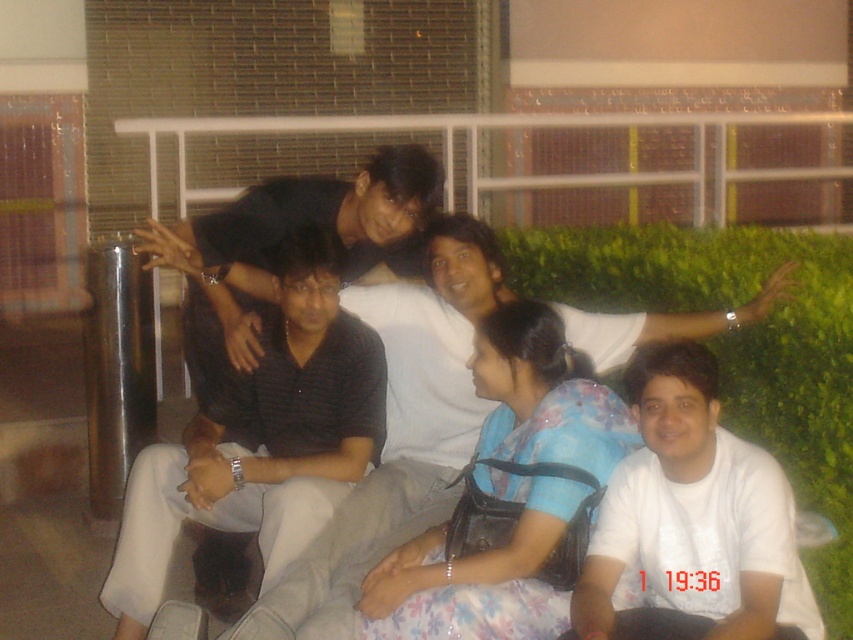
Where is `white matte shirt at lower right`? The width and height of the screenshot is (853, 640). white matte shirt at lower right is located at coordinates (693, 520).

Is white matte shirt at lower right shorter than floral fabric dress at center?

Indeed, white matte shirt at lower right has a lesser height compared to floral fabric dress at center.

Does point (643, 504) come farther from viewer compared to point (425, 545)?

No.

Where is `white matte shirt at lower right`? The width and height of the screenshot is (853, 640). white matte shirt at lower right is located at coordinates (693, 520).

Can you confirm if dark gray shirt at center is thinner than floral fabric dress at center?

In fact, dark gray shirt at center might be wider than floral fabric dress at center.

How much distance is there between dark gray shirt at center and floral fabric dress at center?

They are 13.74 inches apart.

Between point (364, 547) and point (509, 380), which one is positioned in front?

Point (509, 380)

Identify the location of dark gray shirt at center. (397, 429).

Is dark gray striped shirt at center smaller than dark gray shirt at center?

Correct, dark gray striped shirt at center occupies less space than dark gray shirt at center.

Is dark gray striped shirt at center further to camera compared to dark gray shirt at center?

Yes.

Does point (289, 508) come behind point (320, 554)?

Yes.

You are a GUI agent. You are given a task and a screenshot of the screen. Output one action in this format:
    pyautogui.click(x=<x>, y=<y>)
    Task: Click on the dark gray striped shirt at center
    
    Given the screenshot: What is the action you would take?
    pyautogui.click(x=260, y=438)